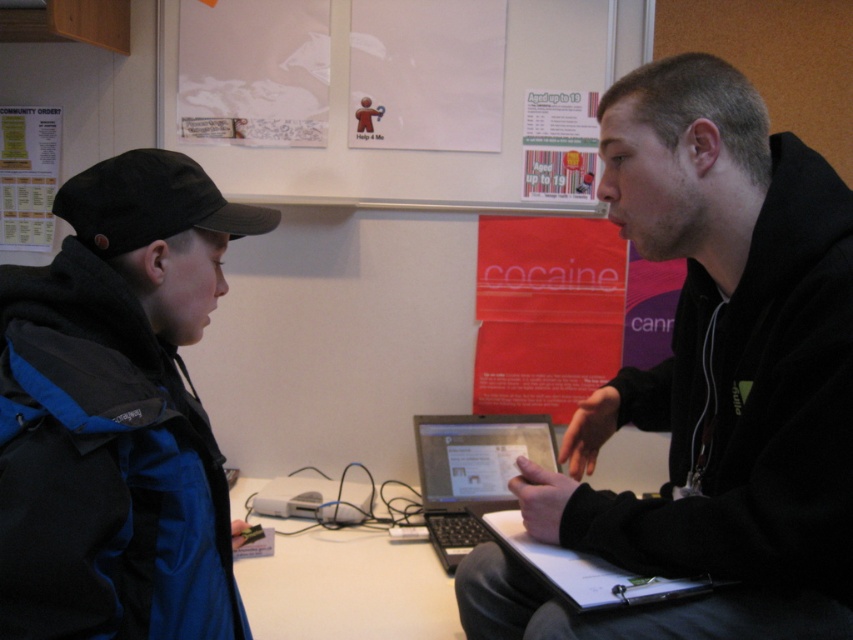
Which is behind, point (13, 342) or point (540, 96)?

Point (540, 96)

Who is more distant from viewer, (13, 614) or (549, 196)?

The point (549, 196) is behind.

Locate an element on the screen. The width and height of the screenshot is (853, 640). blue fabric jacket at left is located at coordinates (117, 412).

Which is in front, point (320, 129) or point (453, 536)?

Point (453, 536) is more forward.

Does white paper poster at upper left lie behind silver metallic laptop at center?

Yes, it is.

Measure the distance between point (x=204, y=77) and camera.

6.24 feet

Locate an element on the screen. This screenshot has width=853, height=640. white paper poster at upper left is located at coordinates (253, 72).

Is red paper poster at center closer to camera compared to white paper at upper center?

No, it is behind white paper at upper center.

Is red paper poster at center shorter than white paper at upper center?

No, red paper poster at center is not shorter than white paper at upper center.

Who is more distant from viewer, (556, 355) or (495, 144)?

Positioned behind is point (556, 355).

Image resolution: width=853 pixels, height=640 pixels. Find the location of `red paper poster at center`. red paper poster at center is located at coordinates (544, 312).